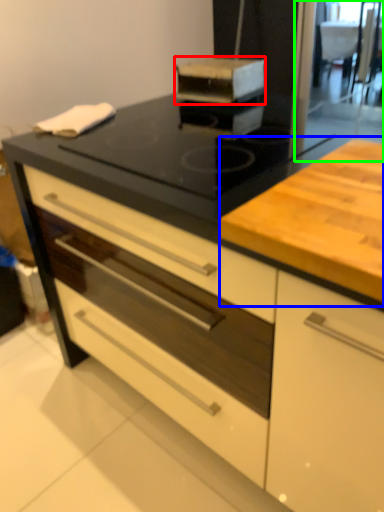
Question: Estimate the real-world distances between objects in this image. Which object is farther from kitchen appliance (highlighted by a red box), counter (highlighted by a blue box) or screen door (highlighted by a green box)?

Choices:
 (A) counter
 (B) screen door

Answer: (A)